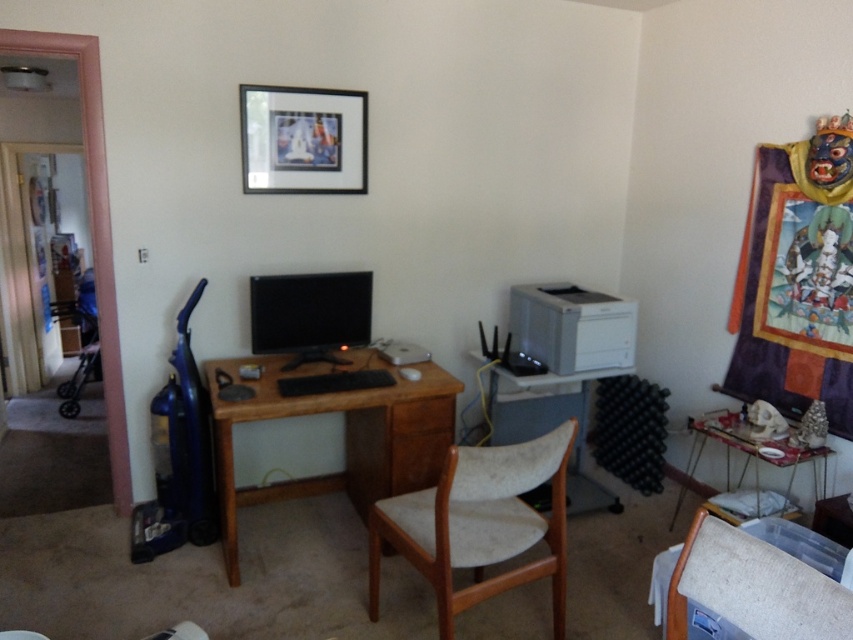
You are organizing a small gathering in the room and need to place a round tablecloth that is 1.2 meters in diameter. Which object between the light brown wood chair at center and the metallic silver table at lower right can the tablecloth fit on?

The light brown wood chair at center is larger in size than the metallic silver table at lower right, so the tablecloth would fit better on the light brown wood chair at center.

You are organizing a small gathering in the room and need to determine if the light brown wood chair at center can fit under the brown wood computer desk at center. Can it fit?

The light brown wood chair at center has a smaller size compared to brown wood computer desk at center, so it can fit under the brown wood computer desk at center.

You are standing in the room and want to hang a new picture frame that is 1 foot thick. The black matte picture frame at upper center is currently occupying space. Can you fit your new frame next to it without moving the existing one?

The black matte picture frame at upper center is 9.92 feet away from the viewer. Since the distance is more than enough to accommodate the 1 foot thick new frame, you can fit it next to the existing frame without moving it.